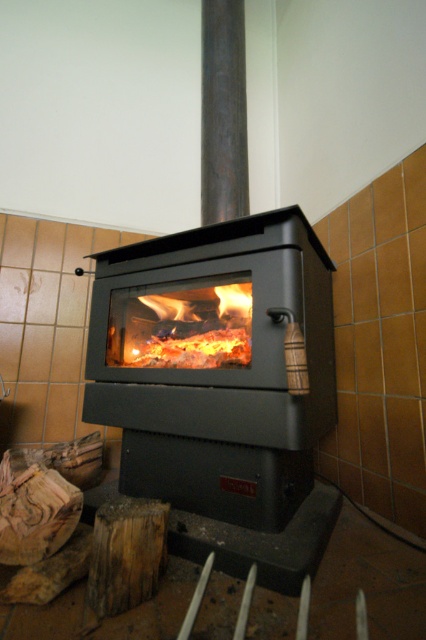
Question: Among these objects, which one is nearest to the camera?

Choices:
 (A) orange glowing wood at center
 (B) matte black fireplace at center

Answer: (B)

Question: Which point appears closest to the camera in this image?

Choices:
 (A) (186, 326)
 (B) (46, 518)
 (C) (137, 604)
 (D) (319, 348)

Answer: (C)

Question: Is matte black fireplace at center to the left of wooden log at lower left from the viewer's perspective?

Choices:
 (A) no
 (B) yes

Answer: (A)

Question: Is weathered wood at lower left smaller than wooden log at lower left?

Choices:
 (A) no
 (B) yes

Answer: (B)

Question: Which of the following is the closest to the observer?

Choices:
 (A) weathered wood at lower left
 (B) matte black fireplace at center
 (C) wooden log at lower left
 (D) orange glowing wood at center

Answer: (A)

Question: Can you confirm if weathered wood at lower left is positioned to the left of wooden log at lower left?

Choices:
 (A) yes
 (B) no

Answer: (B)